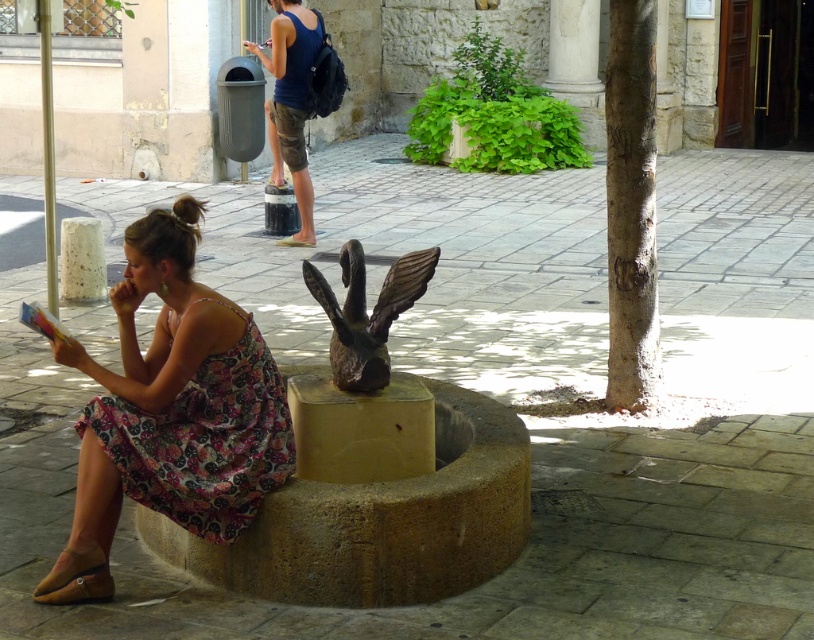
Question: Is floral print fabric dress at lower left closer to camera compared to bronze statue at center?

Choices:
 (A) no
 (B) yes

Answer: (B)

Question: Does floral print fabric dress at lower left have a greater width compared to matte blue tank top at upper center?

Choices:
 (A) no
 (B) yes

Answer: (A)

Question: Which of the following is the closest to the observer?

Choices:
 (A) (252, 378)
 (B) (351, 276)

Answer: (A)

Question: Which is farther from the floral print fabric dress at lower left?

Choices:
 (A) bronze statue at center
 (B) matte blue tank top at upper center

Answer: (B)

Question: Is the position of floral print fabric dress at lower left less distant than that of bronze statue at center?

Choices:
 (A) no
 (B) yes

Answer: (B)

Question: Among these points, which one is farthest from the camera?

Choices:
 (A) (352, 337)
 (B) (272, 120)
 (C) (219, 476)

Answer: (B)